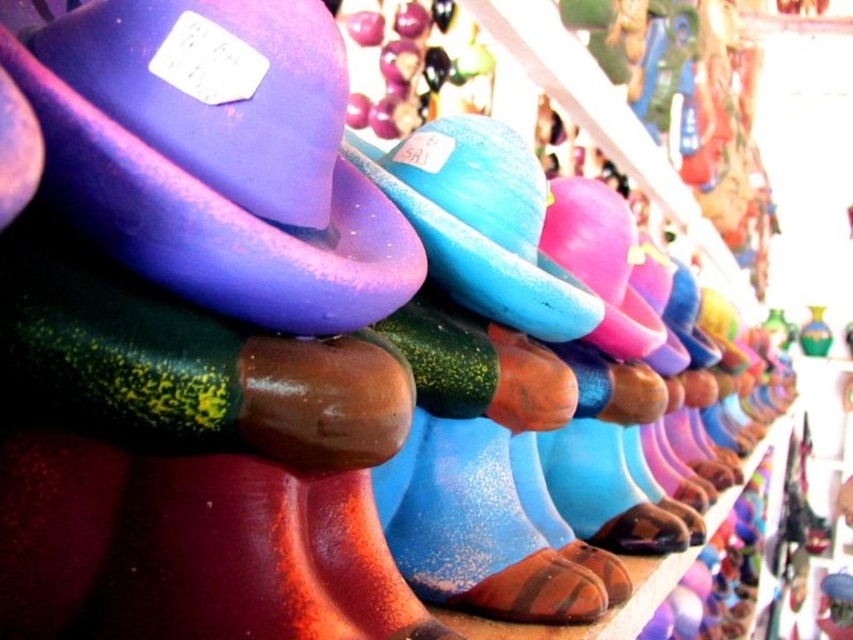
Question: Which of the following is the farthest from the observer?

Choices:
 (A) purple matte hat at upper left
 (B) satin blue hat at center

Answer: (B)

Question: Which object is farther from the camera taking this photo?

Choices:
 (A) satin blue hat at center
 (B) purple matte hat at upper left

Answer: (A)

Question: Does purple matte hat at upper left have a greater width compared to satin blue hat at center?

Choices:
 (A) no
 (B) yes

Answer: (A)

Question: Among these points, which one is farthest from the camera?

Choices:
 (A) (347, 204)
 (B) (488, 234)

Answer: (B)

Question: Where is purple matte hat at upper left located in relation to satin blue hat at center in the image?

Choices:
 (A) right
 (B) left

Answer: (B)

Question: Can you confirm if purple matte hat at upper left is wider than satin blue hat at center?

Choices:
 (A) yes
 (B) no

Answer: (B)